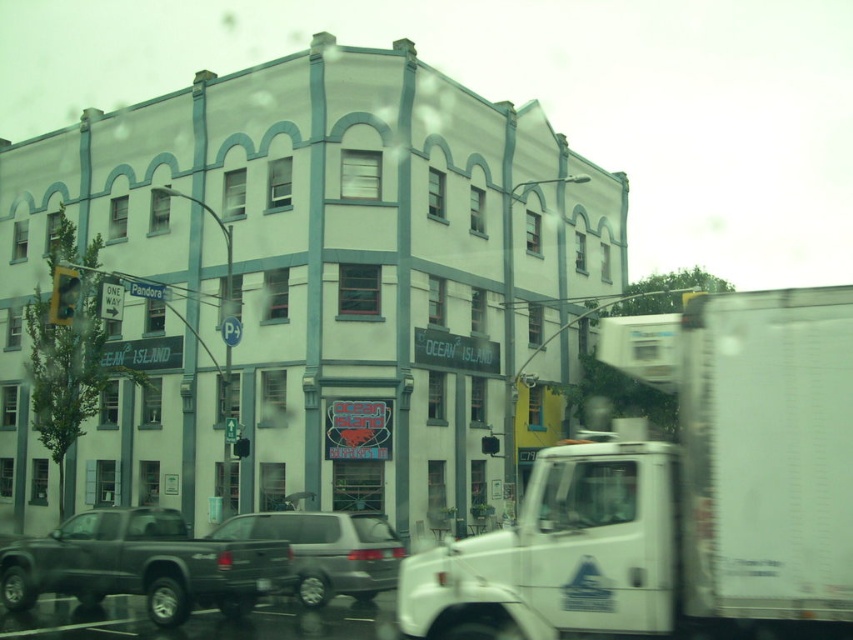
Is white matte truck at center thinner than matte black truck at lower left?

Correct, white matte truck at center's width is less than matte black truck at lower left's.

At what (x,y) coordinates should I click in order to perform the action: click on white matte truck at center. Please return your answer as a coordinate pair (x, y). This screenshot has width=853, height=640. Looking at the image, I should click on [679, 493].

Between matte black truck at lower left and silver metallic suv at center, which one is positioned lower?

silver metallic suv at center is below.

Which is in front, point (54, 547) or point (316, 532)?

Point (54, 547)

I want to click on matte black truck at lower left, so click(x=141, y=564).

Who is taller, white matte truck at center or silver metallic suv at center?

Standing taller between the two is silver metallic suv at center.

Does white matte truck at center appear over silver metallic suv at center?

Yes.

Image resolution: width=853 pixels, height=640 pixels. I want to click on white matte truck at center, so click(x=679, y=493).